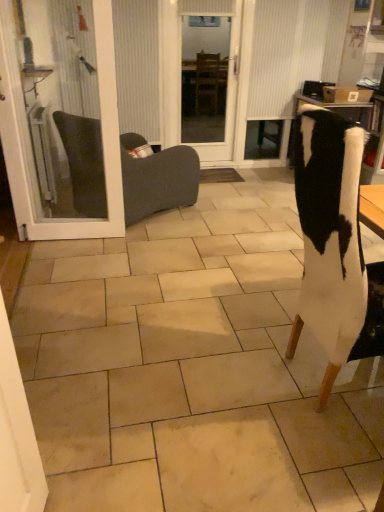
At what (x,y) coordinates should I click in order to perform the action: click on vacant space positioned to the left of white fur chair at right, placed as the second chair when sorted from left to right. Please return your answer as a coordinate pair (x, y). Looking at the image, I should click on (230, 373).